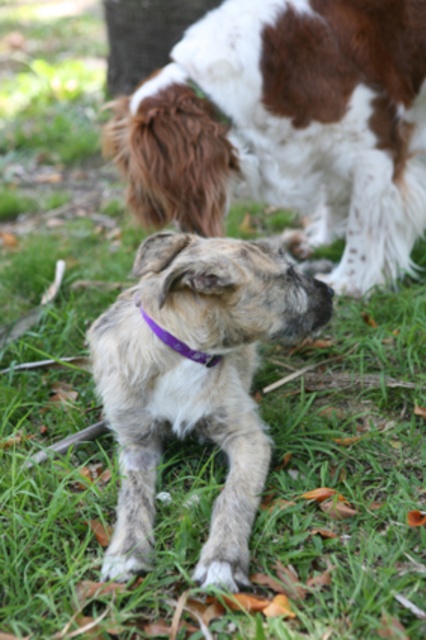
Between fuzzy gray dog at center and purple fabric neckband at center, which one is positioned lower?

Positioned lower is fuzzy gray dog at center.

Is fuzzy gray dog at center further to camera compared to purple fabric neckband at center?

No, fuzzy gray dog at center is in front of purple fabric neckband at center.

Is point (166, 301) farther from viewer compared to point (184, 342)?

No, it is not.

The height and width of the screenshot is (640, 426). I want to click on fuzzy gray dog at center, so click(x=195, y=376).

Between short-haired brown dog at center and purple fabric neckband at center, which one is positioned higher?

short-haired brown dog at center is higher up.

The height and width of the screenshot is (640, 426). I want to click on short-haired brown dog at center, so click(x=288, y=125).

Can you confirm if fuzzy gray dog at center is thinner than fuzzy fur paw at lower center?

No.

Who is higher up, fuzzy gray dog at center or fuzzy fur paw at lower center?

fuzzy gray dog at center is above.

Between point (226, 504) and point (210, 579), which one is positioned behind?

The point (226, 504) is more distant.

This screenshot has height=640, width=426. Find the location of `fuzzy gray dog at center`. fuzzy gray dog at center is located at coordinates (195, 376).